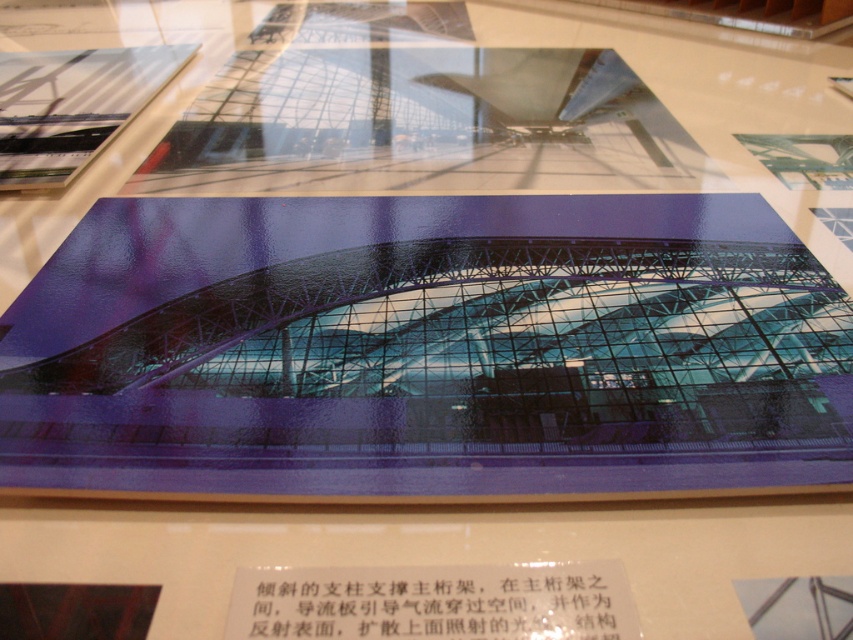
Measure the distance between white paper at center and transparent glass structure at upper left.

The distance of white paper at center from transparent glass structure at upper left is 1.19 meters.

Who is taller, white paper at center or transparent glass structure at upper left?

Standing taller between the two is transparent glass structure at upper left.

Find the location of a particular element. white paper at center is located at coordinates (434, 602).

Locate an element on the screen. This screenshot has width=853, height=640. white paper at center is located at coordinates pyautogui.click(x=434, y=602).